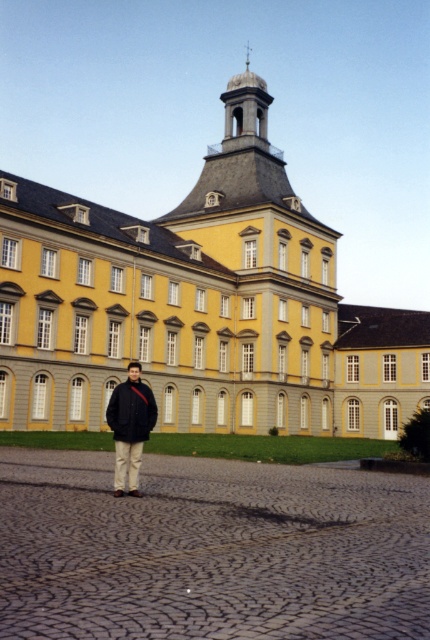
You are a photographer trying to capture the full height of the yellow matte building at center while also including the dark blue woolen jacket at center in the frame. Given the height difference between them, will you need to adjust your camera angle to ensure both are fully visible?

The yellow matte building at center is much taller than the dark blue woolen jacket at center, so you will need to adjust your camera angle to capture both the full height of the building and the jacket in the frame.

In the scene shown: You are a photographer trying to capture the yellow matte building at center and the dark gray fabric jacket at center in a single frame. Given their sizes, will the building appear larger than the jacket in the photo?

The yellow matte building at center is much taller than the dark gray fabric jacket at center, so yes, the building will appear larger than the jacket in the photo.

You are standing in the plaza and want to take a photo of the yellow matte building at center without the dark blue woolen jacket at center appearing in the frame. Which direction should you move to achieve this?

Move to the right of the yellow matte building at center so that the dark blue woolen jacket at center is no longer in the frame.